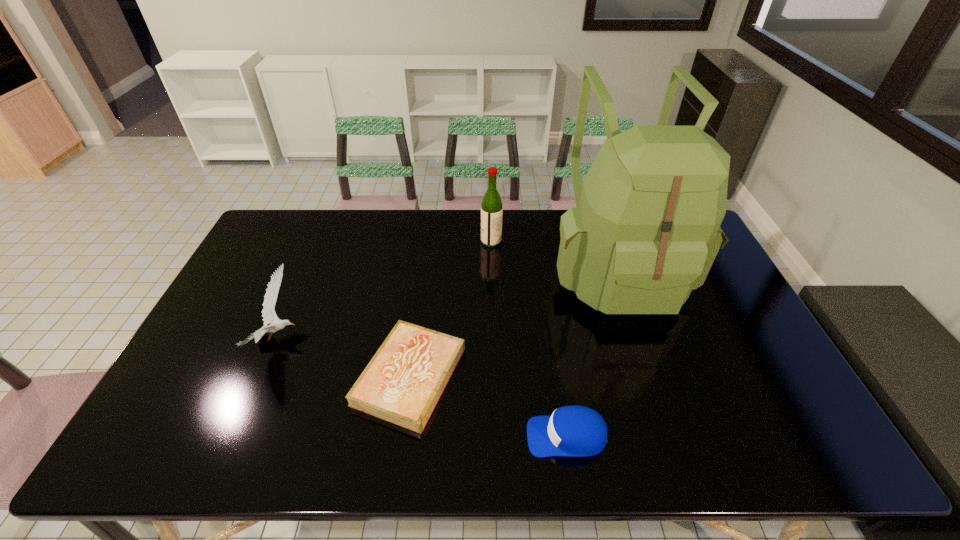
At what (x,y) coordinates should I click in order to perform the action: click on object that is the third closest to the second object from left to right. Please return your answer as a coordinate pair (x, y). The image size is (960, 540). Looking at the image, I should click on (645, 232).

Identify which object is the nearest to the backpack. Please provide its 2D coordinates. Your answer should be formatted as a tuple, i.e. [(x, y)], where the tuple contains the x and y coordinates of a point satisfying the conditions above.

[(491, 206)]

This screenshot has width=960, height=540. I want to click on free space that satisfies the following two spatial constraints: 1. at the tip of the beak of the third tallest object; 2. on the left side of the hardback book, so click(263, 376).

Where is `vacant space that satisfies the following two spatial constraints: 1. on the front pocket of the tallest object; 2. at the tip of the beak of the gull`? Image resolution: width=960 pixels, height=540 pixels. vacant space that satisfies the following two spatial constraints: 1. on the front pocket of the tallest object; 2. at the tip of the beak of the gull is located at coordinates coord(639,339).